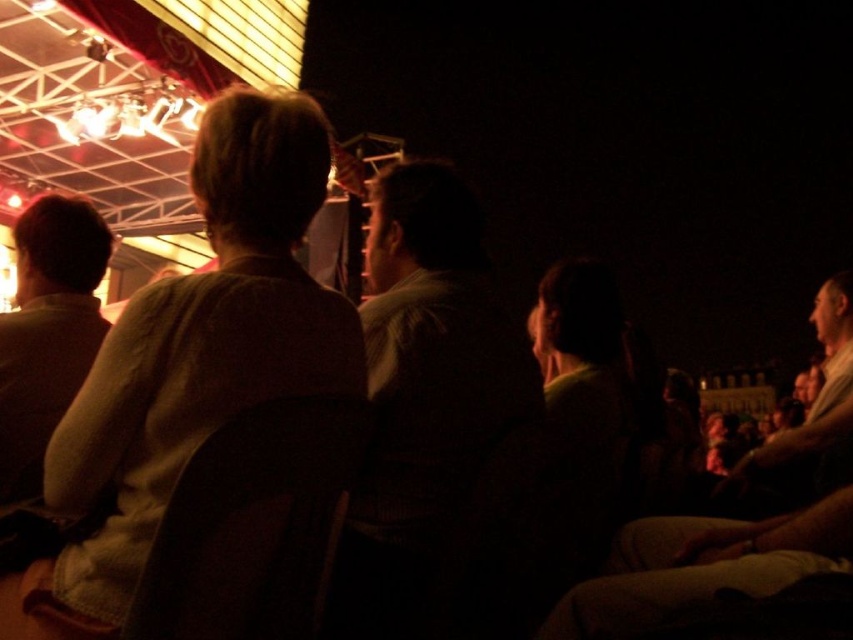
Question: Can you confirm if light brown fabric jacket at center is smaller than dark brown sweater at center?

Choices:
 (A) no
 (B) yes

Answer: (B)

Question: Which point is farther to the camera?

Choices:
 (A) [x=16, y=260]
 (B) [x=498, y=472]

Answer: (A)

Question: Which of the following is the closest to the observer?

Choices:
 (A) (287, 132)
 (B) (30, 496)
 (C) (403, 324)

Answer: (B)

Question: Can you confirm if light brown fabric jacket at center is positioned to the right of dark brown sweater at center?

Choices:
 (A) no
 (B) yes

Answer: (A)

Question: Does light brown fabric jacket at center come behind dark brown sweater at center?

Choices:
 (A) yes
 (B) no

Answer: (B)

Question: Which object appears farthest from the camera in this image?

Choices:
 (A) light brown fabric jacket at center
 (B) light brown shirt at left

Answer: (B)